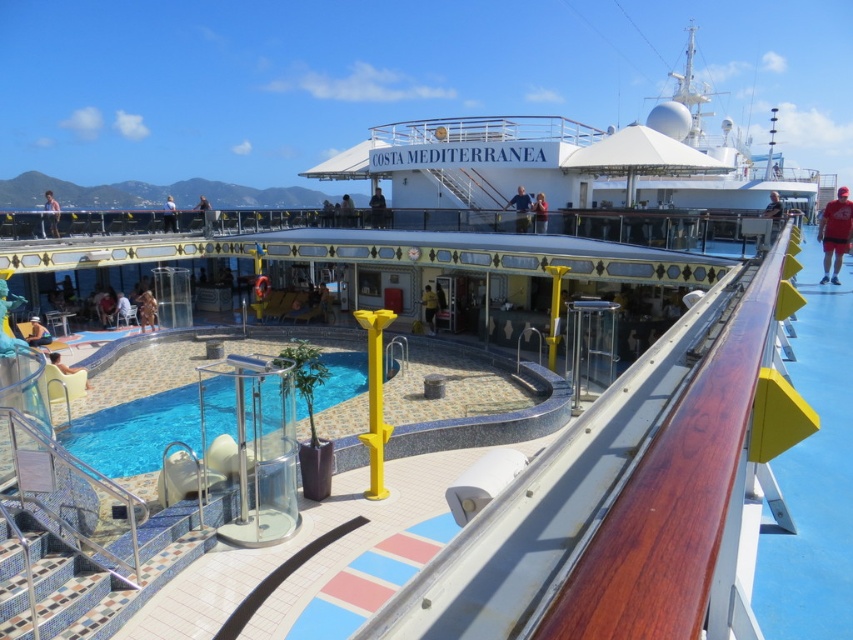
Who is positioned more to the right, dark brown leather jacket at upper center or light brown wooden chair at upper center?

dark brown leather jacket at upper center

Who is lower down, dark brown leather jacket at upper center or light brown wooden chair at upper center?

dark brown leather jacket at upper center is lower down.

Between point (373, 209) and point (164, 218), which one is positioned behind?

The point (164, 218) is behind.

This screenshot has width=853, height=640. Identify the location of dark brown leather jacket at upper center. (376, 209).

Can you confirm if brown leather jacket at lower left is shorter than matte blue shirt at upper center?

Yes.

From the picture: Is brown leather jacket at lower left below matte blue shirt at upper center?

Yes, brown leather jacket at lower left is below matte blue shirt at upper center.

Locate an element on the screen. brown leather jacket at lower left is located at coordinates (146, 308).

This screenshot has height=640, width=853. I want to click on brown leather jacket at lower left, so click(x=146, y=308).

Which is more to the right, matte black person at upper left or matte blue shirt at upper center?

matte blue shirt at upper center is more to the right.

Does point (54, 211) lie in front of point (538, 211)?

No.

Find the location of a particular element. matte black person at upper left is located at coordinates (51, 212).